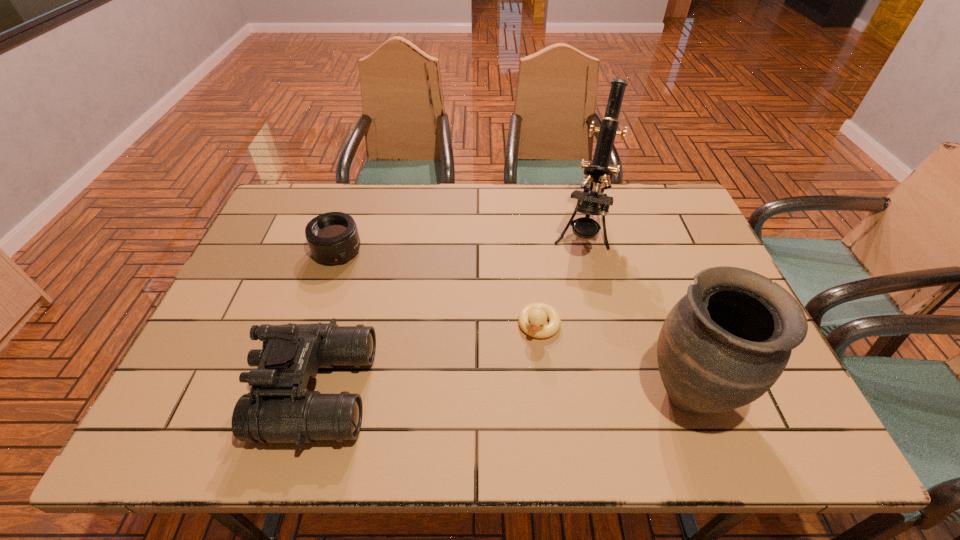
This screenshot has width=960, height=540. Find the location of `object at the right edge`. object at the right edge is located at coordinates (724, 344).

This screenshot has width=960, height=540. Find the location of `object that is at the near right corner`. object that is at the near right corner is located at coordinates (724, 344).

The image size is (960, 540). I want to click on vacant point at the far edge, so click(564, 197).

You are a GUI agent. You are given a task and a screenshot of the screen. Output one action in this format:
    pyautogui.click(x=<x>, y=<y>)
    Task: Click on the vacant position at the near edge of the desktop
    
    Given the screenshot: What is the action you would take?
    pyautogui.click(x=391, y=376)

Locate an element on the screen. vacant area at the left edge of the desktop is located at coordinates (252, 314).

This screenshot has width=960, height=540. In the image, there is a desktop. Find the location of `vacant space at the far left corner`. vacant space at the far left corner is located at coordinates (287, 210).

Identify the location of vacant space that's between the fourth shortest object and the third shortest object. (503, 392).

Locate an element on the screen. vacant region between the third object from left to right and the third shortest object is located at coordinates (428, 358).

Locate an element on the screen. The width and height of the screenshot is (960, 540). vacant space in between the fourth shortest object and the telephoto lens is located at coordinates (514, 322).

Image resolution: width=960 pixels, height=540 pixels. Find the location of `free spot between the microscope and the duckling`. free spot between the microscope and the duckling is located at coordinates (561, 279).